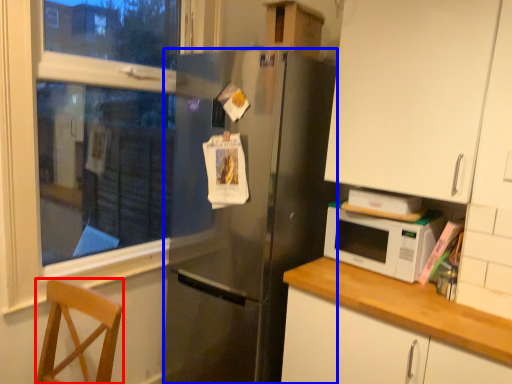
Question: Among these objects, which one is farthest to the camera, chair (highlighted by a red box) or refrigerator (highlighted by a blue box)?

Choices:
 (A) chair
 (B) refrigerator

Answer: (B)